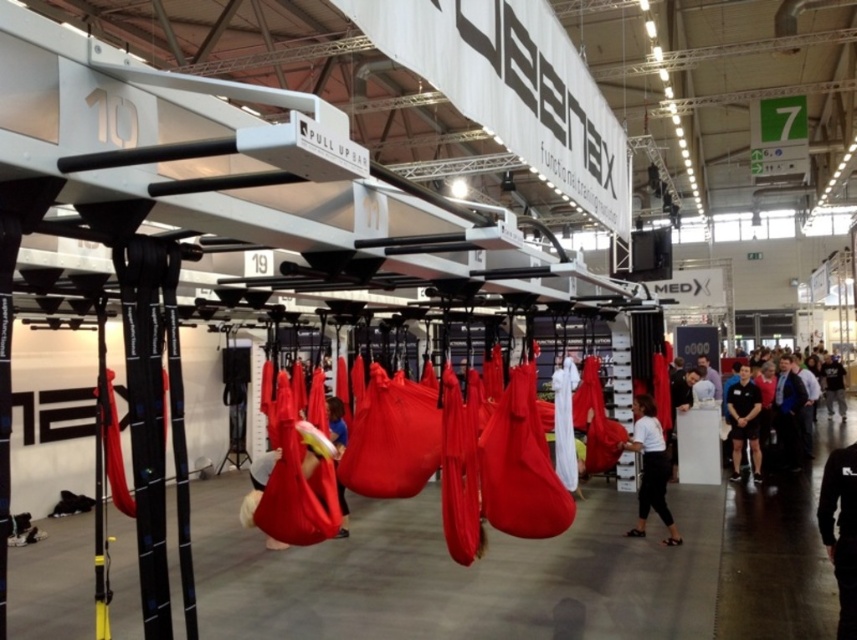
You are a photographer at the Jeenex booth and need to capture a closeup of both the white matte shirt at center and the blue fabric at center. Since your camera can only focus on one object at a time, which object should you adjust the focus for first if you want to ensure the wider object is in focus?

The white matte shirt at center is wider than the blue fabric at center, so you should adjust the focus for the white matte shirt at center first.

You are a photographer at the event and want to capture a photo that includes both the black fabric pants at lower right and the white matte shirt at center. Based on their positions, which one should you focus on first to ensure both are in the frame?

The black fabric pants at lower right is above the white matte shirt at center, so you should focus on the white matte shirt at center first to ensure both are in the frame.

You are a photographer setting up for a photoshoot in this exhibition space. You need to position a light source to the left of the white matte shirt at center. Where should you place it relative to the black fabric pants at lower right?

The black fabric pants at lower right are to the right of the white matte shirt at center. To place the light source to the left of the white matte shirt at center, you should position it to the left of the black fabric pants at lower right.